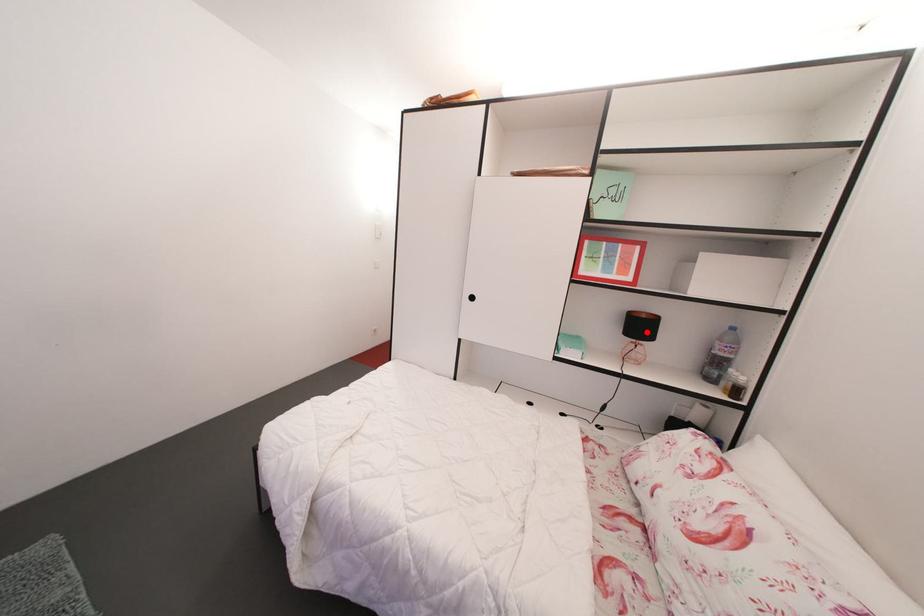
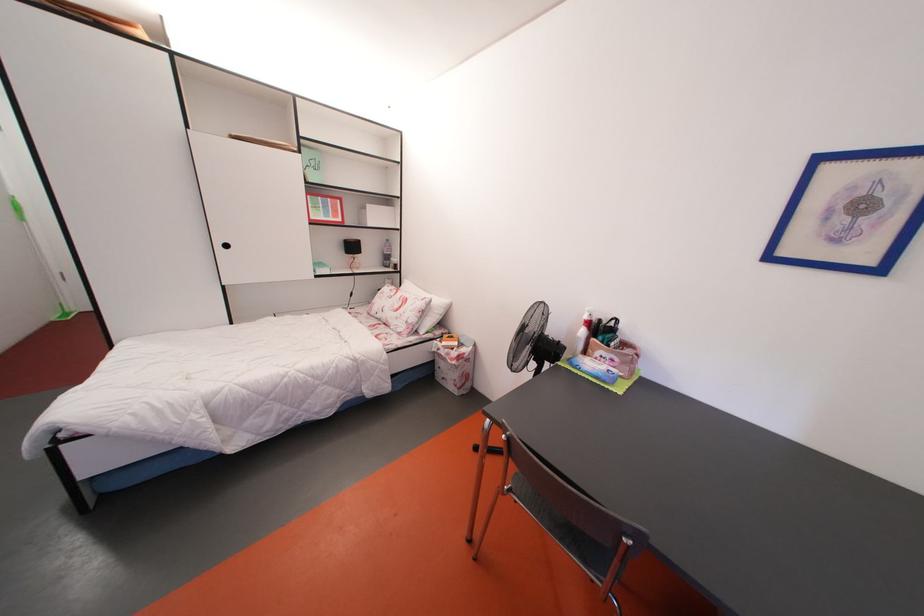
Locate, in the second image, the point that corresponds to the highlighted location in the first image.

(359, 253)